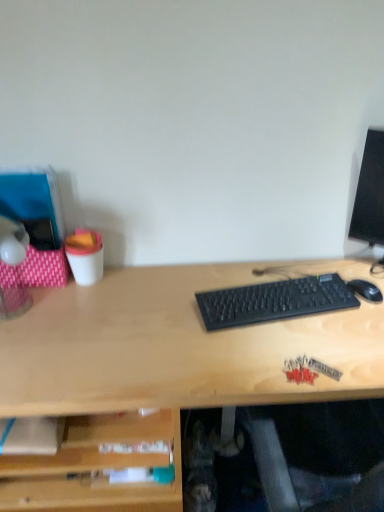
Question: Is black matte mouse at right turned away from translucent plastic lamp at left?

Choices:
 (A) no
 (B) yes

Answer: (A)

Question: From a real-world perspective, is black matte mouse at right under translucent plastic lamp at left?

Choices:
 (A) no
 (B) yes

Answer: (B)

Question: Is black matte mouse at right facing towards translucent plastic lamp at left?

Choices:
 (A) no
 (B) yes

Answer: (A)

Question: Is black matte mouse at right shorter than translucent plastic lamp at left?

Choices:
 (A) no
 (B) yes

Answer: (B)

Question: Is black matte mouse at right at the left side of translucent plastic lamp at left?

Choices:
 (A) no
 (B) yes

Answer: (A)

Question: Is black matte mouse at right to the right of translucent plastic lamp at left from the viewer's perspective?

Choices:
 (A) no
 (B) yes

Answer: (B)

Question: Is translucent plastic lamp at left to the left of black matte mouse at right from the viewer's perspective?

Choices:
 (A) yes
 (B) no

Answer: (A)

Question: Considering the relative sizes of translucent plastic lamp at left and black matte mouse at right in the image provided, is translucent plastic lamp at left thinner than black matte mouse at right?

Choices:
 (A) yes
 (B) no

Answer: (B)

Question: From the image's perspective, would you say translucent plastic lamp at left is shown under black matte mouse at right?

Choices:
 (A) yes
 (B) no

Answer: (B)

Question: Considering the relative positions of translucent plastic lamp at left and black matte mouse at right in the image provided, is translucent plastic lamp at left to the right of black matte mouse at right from the viewer's perspective?

Choices:
 (A) yes
 (B) no

Answer: (B)

Question: Is the position of translucent plastic lamp at left more distant than that of black matte mouse at right?

Choices:
 (A) yes
 (B) no

Answer: (B)

Question: Does translucent plastic lamp at left lie in front of black matte mouse at right?

Choices:
 (A) no
 (B) yes

Answer: (B)

Question: Considering the relative sizes of black plastic keyboard at center and black matte mouse at right in the image provided, is black plastic keyboard at center bigger than black matte mouse at right?

Choices:
 (A) yes
 (B) no

Answer: (A)